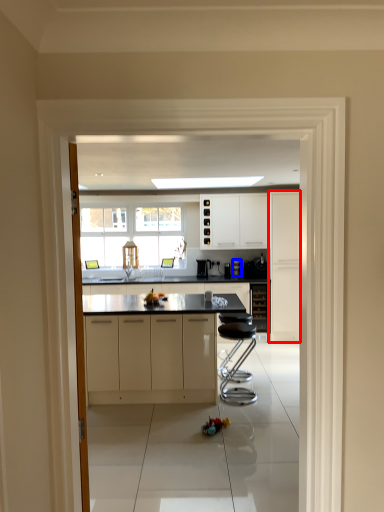
Question: Which object is closer to the camera taking this photo, cabinetry (highlighted by a red box) or coffee machine (highlighted by a blue box)?

Choices:
 (A) cabinetry
 (B) coffee machine

Answer: (A)